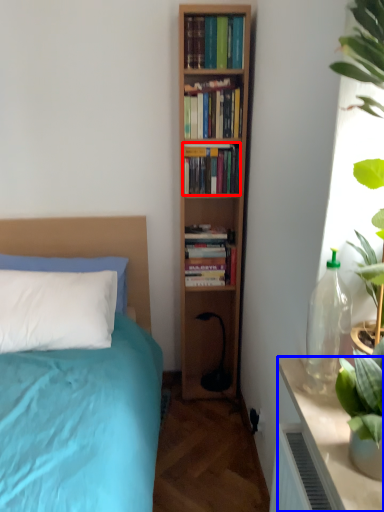
Question: Which object is further to the camera taking this photo, book (highlighted by a red box) or table (highlighted by a blue box)?

Choices:
 (A) book
 (B) table

Answer: (A)